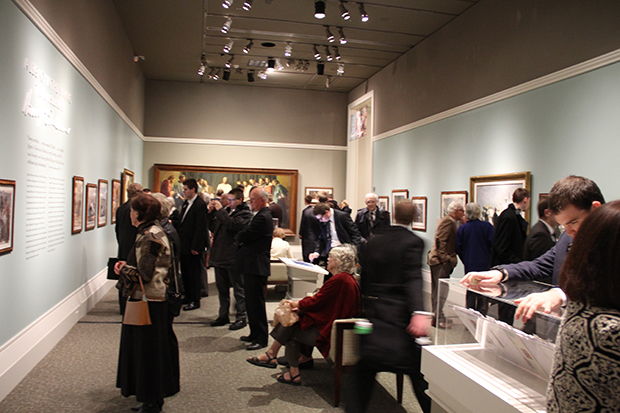
Identify the location of white trim along bottom of blue wall. This screenshot has height=413, width=620. (72, 302), (97, 285), (32, 350).